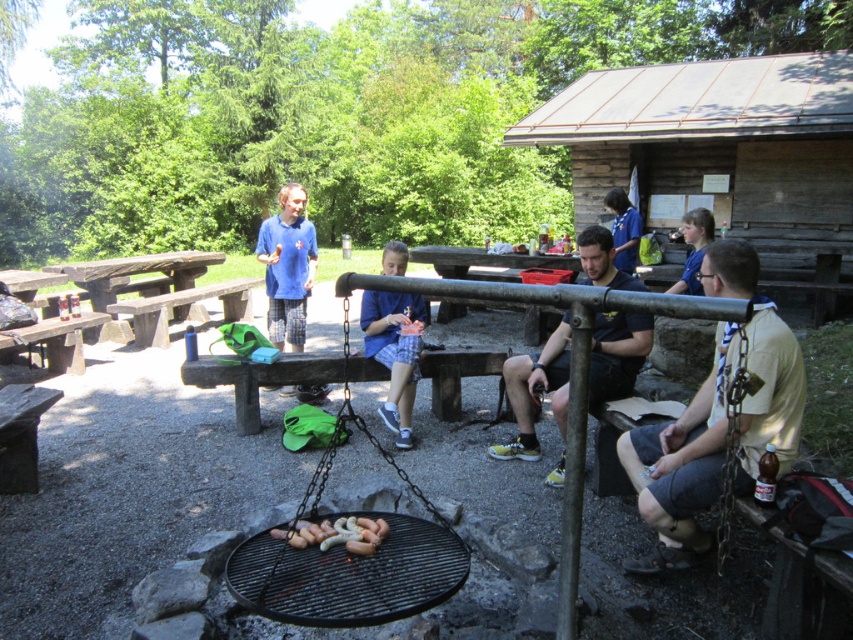
You are planning to cook sausages on the black matte grill at center but need to know if there is enough space between it and the metallic silver water at center to avoid any spills. Can you confirm if the grill is wider or narrower than the water?

The black matte grill at center is thinner than metallic silver water at center, so the grill is narrower than the water. This means there might not be enough space to prevent spills, so caution is advised.

You are planning to set up a small tent at the campsite. You have a tent that requires a flat area of at least 2 meters by 2 meters. Looking at the image, can you determine if the space between the metallic silver water at center and the blue fabric at center is large enough for your tent?

The metallic silver water at center is larger in size than the blue fabric at center, but the exact dimensions of the space between them are not provided. Therefore, it is uncertain whether the area is sufficient for a 2m x 2m tent.